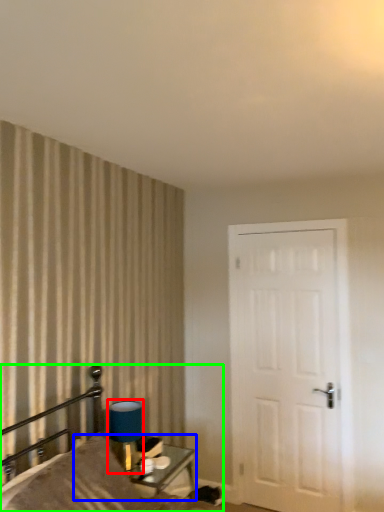
Question: Which is farther away from table lamp (highlighted by a red box)? table (highlighted by a blue box) or bed (highlighted by a green box)?

Choices:
 (A) table
 (B) bed

Answer: (A)